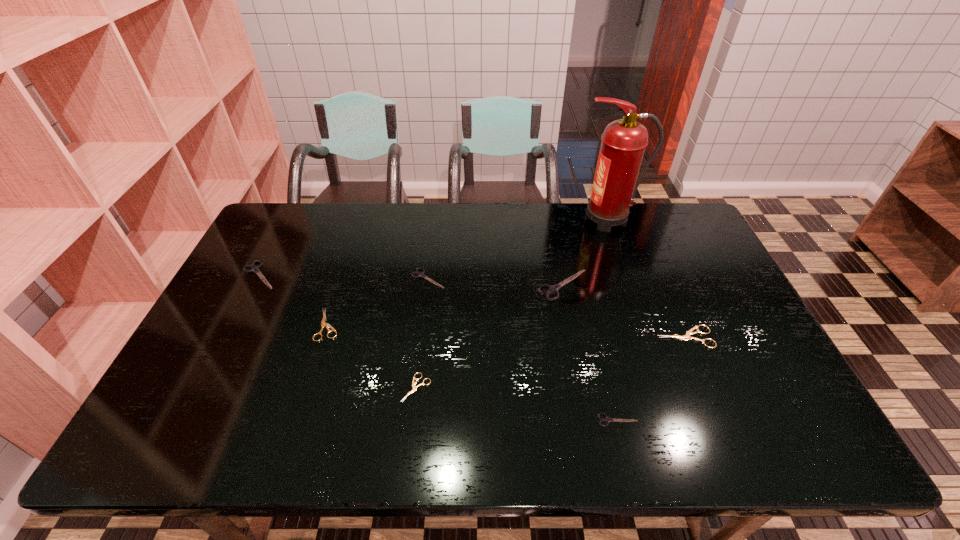
Where is `vacant space located 0.250m on the front of the second smallest black shears`? The height and width of the screenshot is (540, 960). vacant space located 0.250m on the front of the second smallest black shears is located at coordinates pyautogui.click(x=419, y=356).

The height and width of the screenshot is (540, 960). I want to click on vacant space situated on the left of the rightmost shears, so click(632, 337).

The height and width of the screenshot is (540, 960). Identify the location of vacant space located on the front of the second biggest beige shears. (305, 399).

I want to click on free point located on the left of the nearest shears, so click(520, 420).

Identify the location of free region located 0.360m on the right of the nearest beige shears. Image resolution: width=960 pixels, height=540 pixels. (577, 388).

This screenshot has height=540, width=960. I want to click on object that is at the far edge, so click(x=623, y=142).

Find the location of `object situated at the near edge`. object situated at the near edge is located at coordinates (606, 419).

This screenshot has height=540, width=960. I want to click on object that is at the left edge, so click(255, 269).

Where is `object at the right edge`? object at the right edge is located at coordinates (687, 336).

Locate an element on the screen. Image resolution: width=960 pixels, height=540 pixels. blank space at the far edge is located at coordinates (499, 204).